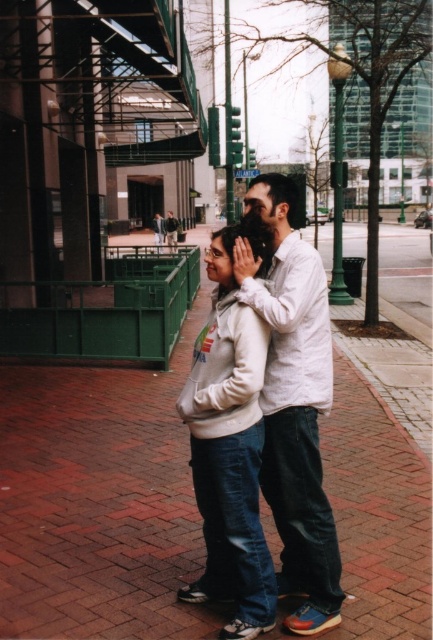
Does white cotton shirt at center appear under white fleece jacket at center?

Incorrect, white cotton shirt at center is not positioned below white fleece jacket at center.

Can you confirm if white cotton shirt at center is thinner than white fleece jacket at center?

No, white cotton shirt at center is not thinner than white fleece jacket at center.

Between point (281, 388) and point (235, 580), which one is positioned in front?

Point (281, 388)

Image resolution: width=433 pixels, height=640 pixels. Find the location of `white cotton shirt at center`. white cotton shirt at center is located at coordinates (294, 403).